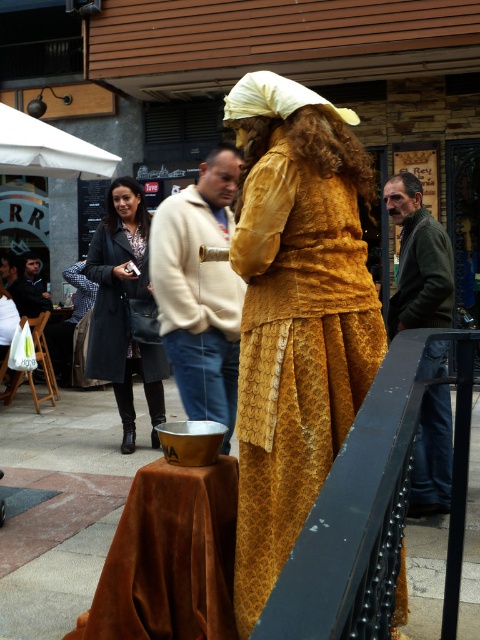
Question: Which object is the farthest from the dark gray coat at center?

Choices:
 (A) dark green jacket at right
 (B) black metal railing at center

Answer: (B)

Question: Is golden textured fabric dress at center wider than dark gray coat at center?

Choices:
 (A) no
 (B) yes

Answer: (A)

Question: Among these points, which one is nearest to the camera?

Choices:
 (A) (358, 630)
 (B) (446, 349)
 (C) (171, 353)
 (D) (301, 428)

Answer: (A)

Question: Does black metal railing at center have a lesser width compared to dark green jacket at right?

Choices:
 (A) yes
 (B) no

Answer: (B)

Question: Which of the following is the farthest from the observer?

Choices:
 (A) (176, 218)
 (B) (352, 509)
 (C) (113, 216)

Answer: (C)

Question: Can you confirm if black metal railing at center is positioned to the right of beige sweater at center?

Choices:
 (A) yes
 (B) no

Answer: (A)